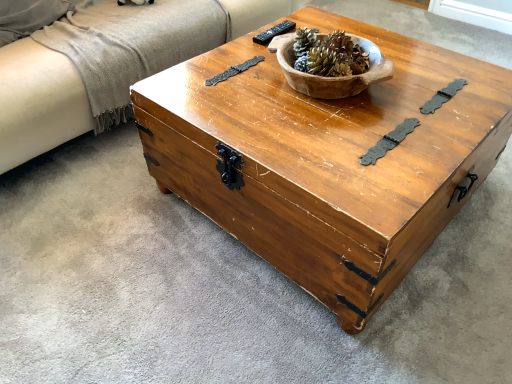
At what (x,y) coordinates should I click in order to perform the action: click on blank area to the left of wooden chest at center. Please return your answer as a coordinate pair (x, y). Looking at the image, I should click on (101, 239).